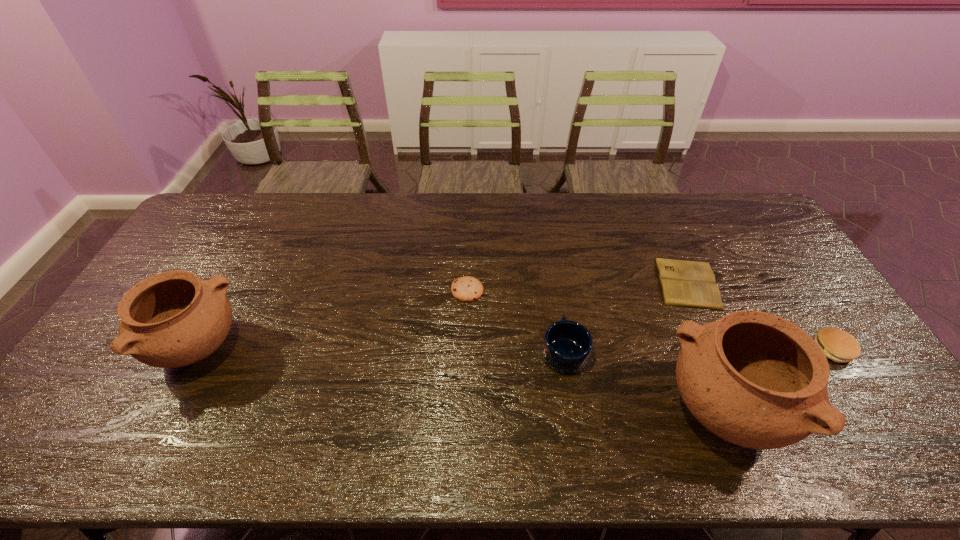
If equal spacing is desired by inserting an extra pottery among them, please point out a free spot for this new pottery. Please provide its 2D coordinates. Your answer should be formatted as a tuple, i.e. [(x, y)], where the tuple contains the x and y coordinates of a point satisfying the conditions above.

[(445, 379)]